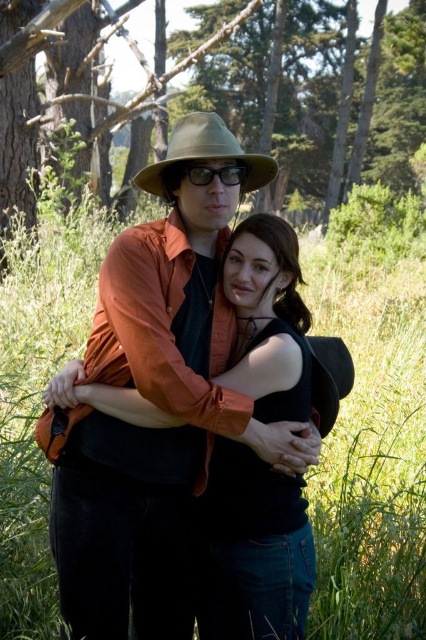
Question: Which of the following is the farthest from the observer?

Choices:
 (A) (345, 483)
 (B) (420, 17)

Answer: (B)

Question: Considering the real-world distances, which object is farthest from the green grass at center?

Choices:
 (A) matte khaki cowboy hat at center
 (B) brown wood tree at upper center

Answer: (B)

Question: Can you confirm if green grass at center is bigger than matte khaki cowboy hat at center?

Choices:
 (A) no
 (B) yes

Answer: (B)

Question: Which of the following is the closest to the observer?

Choices:
 (A) [x=402, y=92]
 (B) [x=213, y=170]
 (C) [x=224, y=132]

Answer: (B)

Question: Is the position of green grass at center more distant than that of brown wood tree at upper center?

Choices:
 (A) yes
 (B) no

Answer: (B)

Question: Considering the relative positions of green grass at center and matte khaki cowboy hat at center in the image provided, where is green grass at center located with respect to matte khaki cowboy hat at center?

Choices:
 (A) above
 (B) below

Answer: (A)